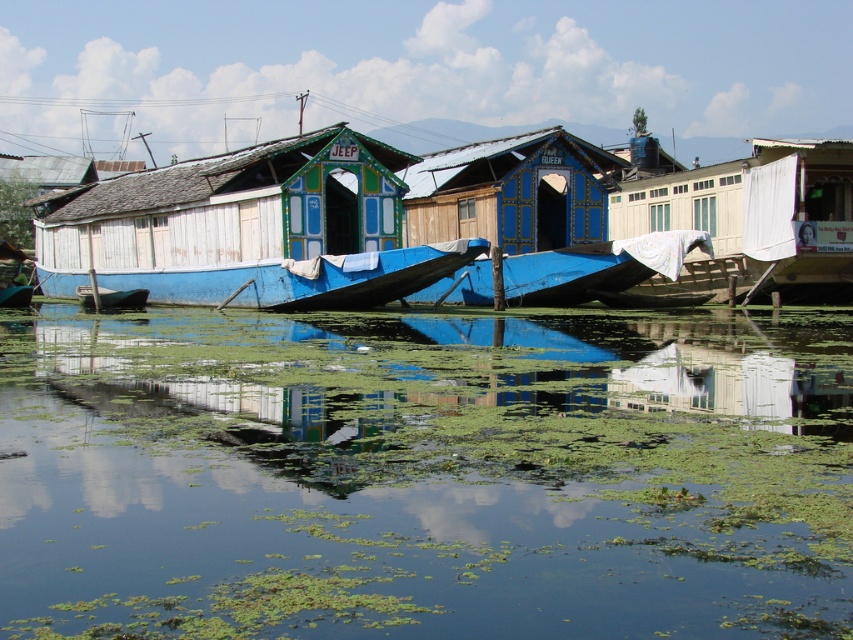
You are a drone operator trying to capture the reflection of the floating houses in the water. According to the coordinates provided, where should you position your drone to best capture the reflection of the green algae water at center?

The green algae water at center is located at coordinates point (424,474), so you should position your drone at that point to best capture its reflection.

You are standing on a floating house and looking at the water surface. There is a point marked as point (424, 474). What is the color of the water at that point?

The green algae water at center is represented by point (424, 474), so the color is green.